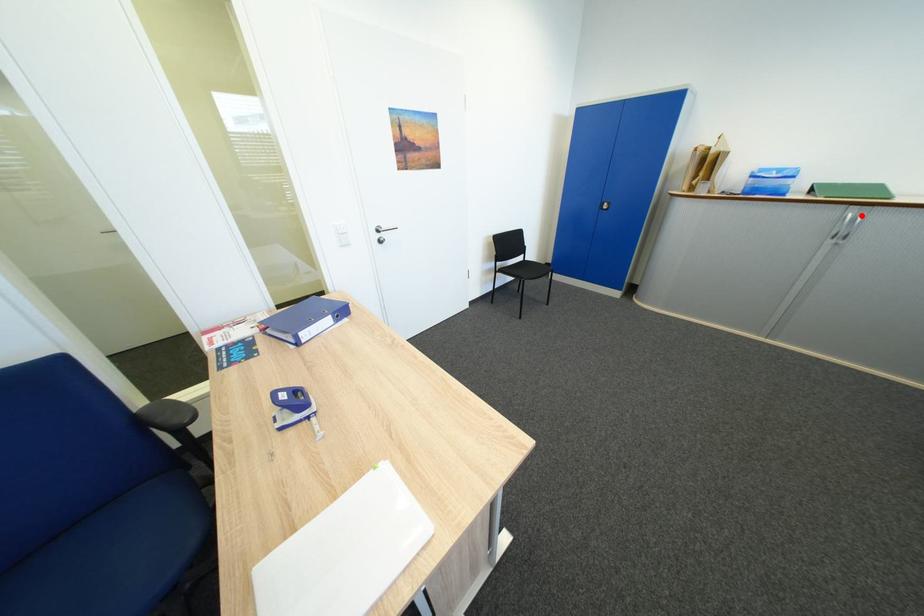
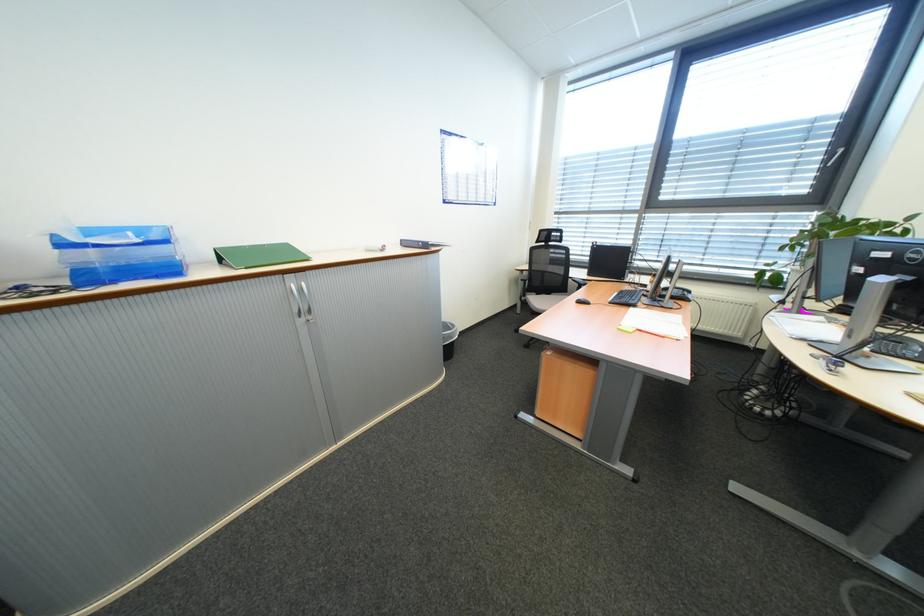
Find the pixel in the second image that matches the highlighted location in the first image.

(302, 286)